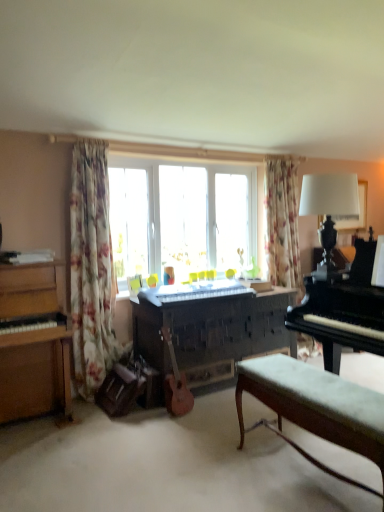
Question: From a real-world perspective, is dark wood piano at center, which is counted as the second piano, starting from the right, physically located above or below white fabric lampshade at upper right?

Choices:
 (A) above
 (B) below

Answer: (B)

Question: From the image's perspective, is dark wood piano at center, marked as the second piano in a left-to-right arrangement, above or below white fabric lampshade at upper right?

Choices:
 (A) above
 (B) below

Answer: (B)

Question: Based on their relative distances, which object is farther from the white glossy picture frame at upper right?

Choices:
 (A) dark wood piano at center, which is counted as the second piano, starting from the right
 (B) wooden piano at left, the first piano in the left-to-right sequence
 (C) wooden acoustic guitar at center
 (D) floral fabric curtain at left, the 2th curtain in the right-to-left sequence
 (E) velvet green bench at lower right

Answer: (B)

Question: Considering the real-world distances, which object is closest to the white fabric lampshade at upper right?

Choices:
 (A) wooden piano at left, which is the third piano from right to left
 (B) wooden acoustic guitar at center
 (C) velvet green bench at lower right
 (D) floral fabric curtain at upper right, the 1th curtain positioned from the back
 (E) white glossy picture frame at upper right

Answer: (E)